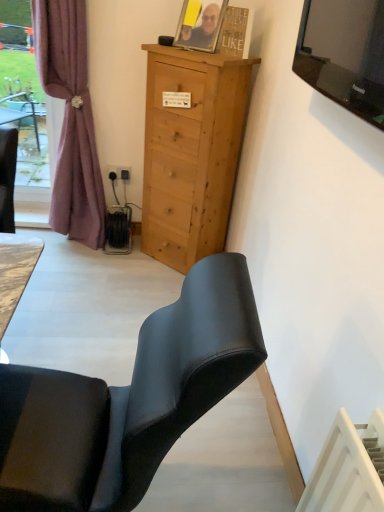
Question: Is point (198, 99) closer or farther from the camera than point (114, 172)?

Choices:
 (A) farther
 (B) closer

Answer: (B)

Question: In terms of size, does light brown wood cabinet at center appear bigger or smaller than black plastic power outlet at lower left?

Choices:
 (A) big
 (B) small

Answer: (A)

Question: Based on their relative distances, which object is nearer to the light brown wood cabinet at center?

Choices:
 (A) mauve fabric curtain at left
 (B) matte black chair at lower left
 (C) matte black photo frame at upper center
 (D) black plastic power outlet at lower left

Answer: (C)

Question: Which object is positioned closest to the black plastic power outlet at lower left?

Choices:
 (A) light brown wood cabinet at center
 (B) mauve fabric curtain at left
 (C) matte black photo frame at upper center
 (D) matte black chair at lower left

Answer: (B)